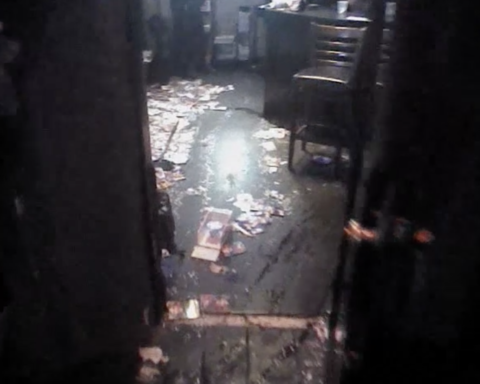
Locate an element on the screen. Image resolution: width=480 pixels, height=384 pixels. countertop is located at coordinates (302, 20).